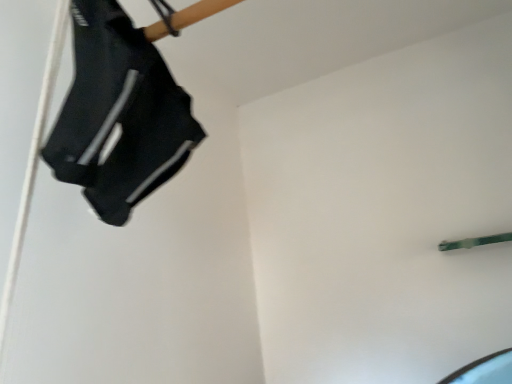
Question: Should I look upward or downward to see black fabric shoe at upper left?

Choices:
 (A) up
 (B) down

Answer: (A)